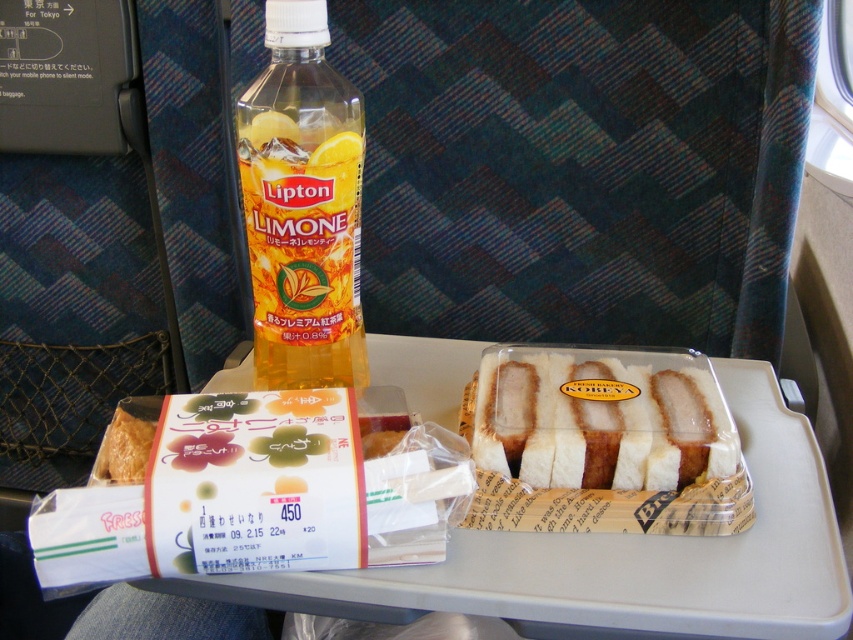
From the picture: Measure the distance between point (306, 230) and camera.

Point (306, 230) and camera are 23.83 inches apart.

What do you see at coordinates (302, 205) in the screenshot?
I see `yellow translucent plastic bottle at center` at bounding box center [302, 205].

Which is behind, point (334, 332) or point (515, 376)?

The point (515, 376) is behind.

Identify the location of yellow translucent plastic bottle at center. (302, 205).